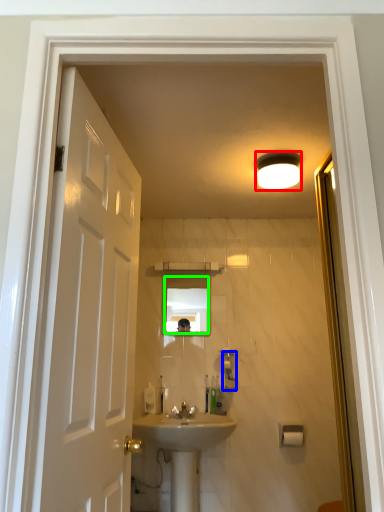
Question: Based on their relative distances, which object is nearer to light fixture (highlighted by a red box)? Choose from soap dispenser (highlighted by a blue box) and mirror (highlighted by a green box).

Choices:
 (A) soap dispenser
 (B) mirror

Answer: (A)